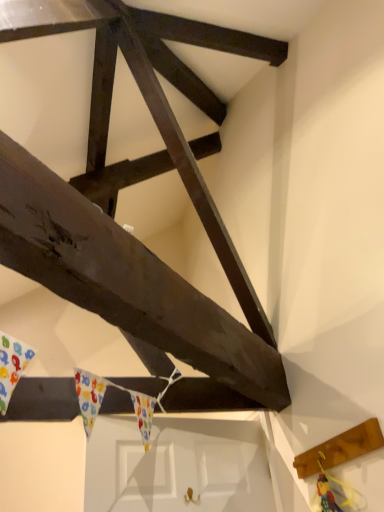
What do you see at coordinates (331, 492) in the screenshot? The width and height of the screenshot is (384, 512). I see `multicolored plastic toy at lower right` at bounding box center [331, 492].

At what (x,y) coordinates should I click in order to perform the action: click on multicolored plastic toy at lower right. Please return your answer as a coordinate pair (x, y). Looking at the image, I should click on (331, 492).

Identify the location of multicolored plastic toy at lower right. (331, 492).